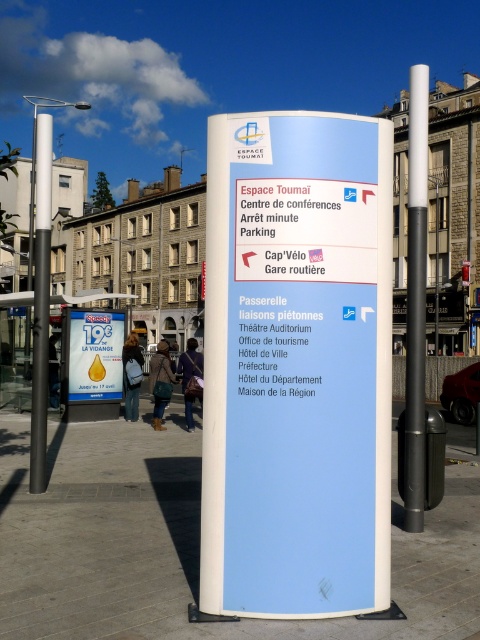
Question: Among these points, which one is nearest to the camera?

Choices:
 (A) (97, 481)
 (B) (261, 460)
 (C) (416, 392)
 (D) (192, 342)

Answer: (B)

Question: Which point appears farthest from the camera in this image?

Choices:
 (A) (11, 394)
 (B) (408, 436)
 (C) (189, 401)
 (D) (434, 593)

Answer: (A)

Question: Can you confirm if smooth concrete pavement at lower center is wider than polished metal pole at left?

Choices:
 (A) yes
 (B) no

Answer: (B)

Question: In this image, where is smooth concrete pavement at lower center located relative to blue plastic sign at center?

Choices:
 (A) left
 (B) right

Answer: (B)

Question: Which of these objects is positioned closest to the white plastic sign at center?

Choices:
 (A) white glossy pole at upper center
 (B) dark brown leather bag at center

Answer: (B)

Question: Does white plastic sign at center appear on the left side of dark brown leather bag at center?

Choices:
 (A) no
 (B) yes

Answer: (A)